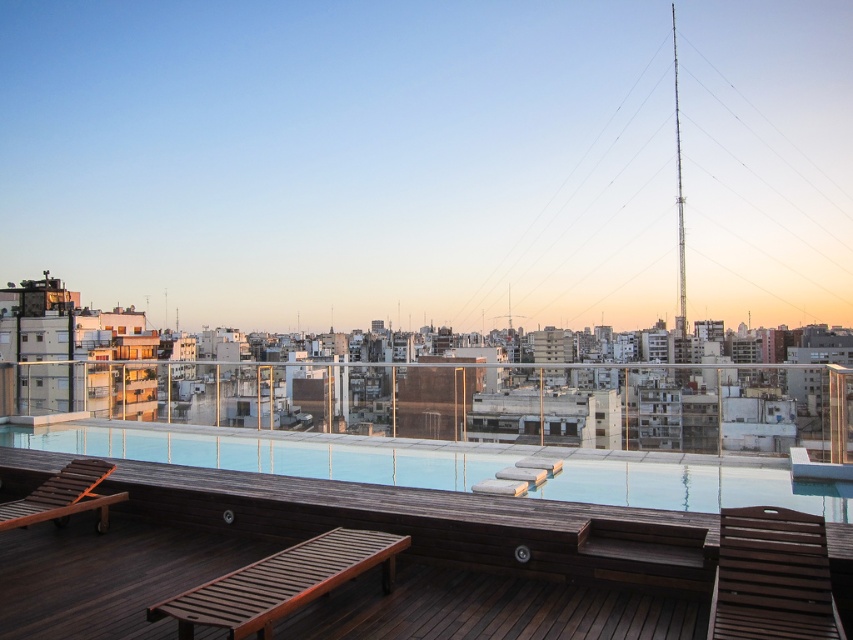
Question: Which object is farther from the camera taking this photo?

Choices:
 (A) smooth gray lounge chair at center
 (B) wooden slatted daybed at lower center

Answer: (A)

Question: Which object is the closest to the brown wooden lounge chair at lower left?

Choices:
 (A) brown wooden deck at center
 (B) brown wooden chair at lower right
 (C) smooth gray lounge chair at center
 (D) smooth wooden deck at lower center

Answer: (A)

Question: Does smooth wooden deck at lower center have a greater width compared to brown wooden lounge chair at lower left?

Choices:
 (A) yes
 (B) no

Answer: (A)

Question: Is wooden slatted daybed at lower center positioned behind smooth gray lounge chair at center?

Choices:
 (A) yes
 (B) no

Answer: (B)

Question: Which point appears closest to the camera in this image?

Choices:
 (A) (750, 596)
 (B) (175, 600)
 (C) (99, 449)
 (D) (593, 611)

Answer: (A)

Question: Does wooden slatted daybed at lower center appear on the left side of smooth gray lounge chair at center?

Choices:
 (A) no
 (B) yes

Answer: (B)